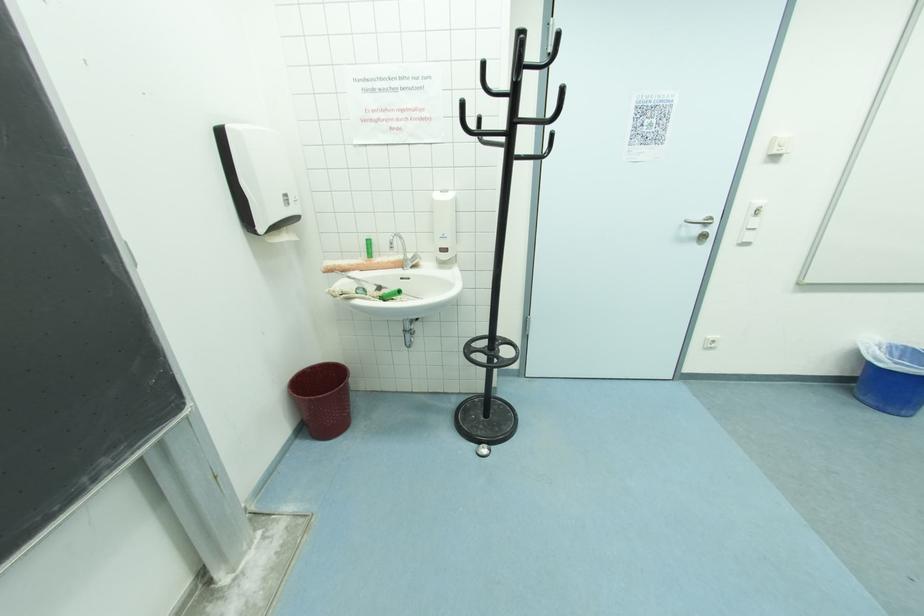
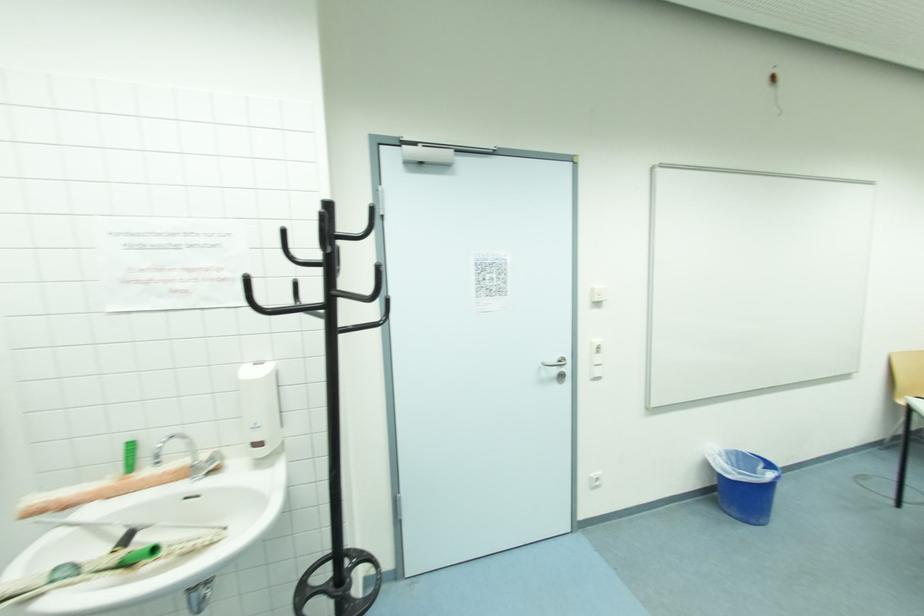
The images are taken continuously from a first-person perspective. In which direction is your viewpoint rotating?

The rotation direction of the camera is right-up.